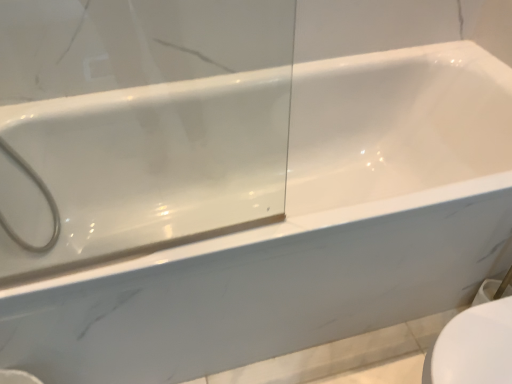
Question: Is white matte showerhead at left positioned with its back to white glossy toilet bowl at lower right?

Choices:
 (A) no
 (B) yes

Answer: (A)

Question: Is white matte showerhead at left to the right of white glossy toilet bowl at lower right from the viewer's perspective?

Choices:
 (A) no
 (B) yes

Answer: (A)

Question: From a real-world perspective, is white matte showerhead at left on top of white glossy toilet bowl at lower right?

Choices:
 (A) yes
 (B) no

Answer: (A)

Question: Are white matte showerhead at left and white glossy toilet bowl at lower right far apart?

Choices:
 (A) yes
 (B) no

Answer: (A)

Question: From a real-world perspective, does white matte showerhead at left sit lower than white glossy toilet bowl at lower right?

Choices:
 (A) no
 (B) yes

Answer: (A)

Question: Does white matte showerhead at left turn towards white glossy toilet bowl at lower right?

Choices:
 (A) yes
 (B) no

Answer: (B)

Question: From the image's perspective, is white glossy toilet bowl at lower right on top of white matte showerhead at left?

Choices:
 (A) no
 (B) yes

Answer: (A)

Question: Is white glossy toilet bowl at lower right bigger than white matte showerhead at left?

Choices:
 (A) no
 (B) yes

Answer: (B)

Question: Is white glossy toilet bowl at lower right aimed at white matte showerhead at left?

Choices:
 (A) no
 (B) yes

Answer: (A)

Question: From a real-world perspective, is white glossy toilet bowl at lower right under white matte showerhead at left?

Choices:
 (A) yes
 (B) no

Answer: (A)

Question: Is white glossy toilet bowl at lower right completely or partially outside of white matte showerhead at left?

Choices:
 (A) yes
 (B) no

Answer: (A)

Question: From the image's perspective, is white glossy toilet bowl at lower right beneath white matte showerhead at left?

Choices:
 (A) no
 (B) yes

Answer: (B)

Question: Does point (53, 238) appear closer or farther from the camera than point (466, 347)?

Choices:
 (A) closer
 (B) farther

Answer: (B)